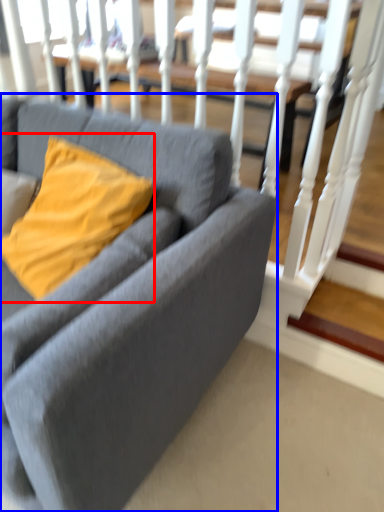
Question: Among these objects, which one is nearest to the camera, pillow (highlighted by a red box) or studio couch (highlighted by a blue box)?

Choices:
 (A) pillow
 (B) studio couch

Answer: (B)